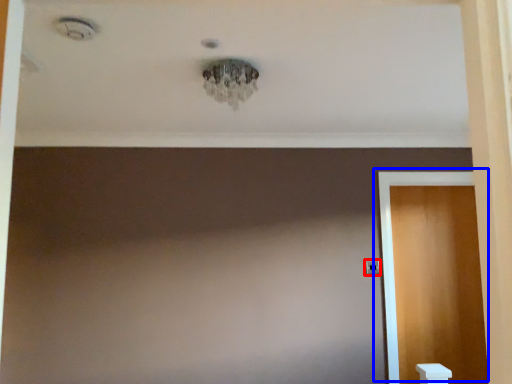
Question: Which of the following is the farthest to the observer, door handle (highlighted by a red box) or door (highlighted by a blue box)?

Choices:
 (A) door handle
 (B) door

Answer: (A)